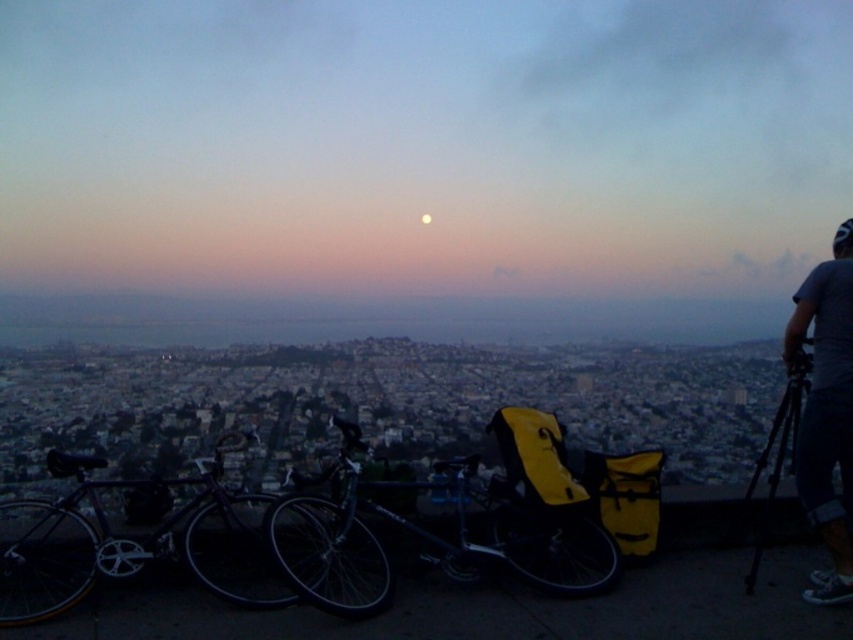
You are planning to ride the shiny black bicycle at left and the blue denim shorts at right. Which one will require less effort to lift onto the back of a pickup truck?

The shiny black bicycle at left is shorter than the blue denim shorts at right, so it will require less effort to lift onto the back of a pickup truck.